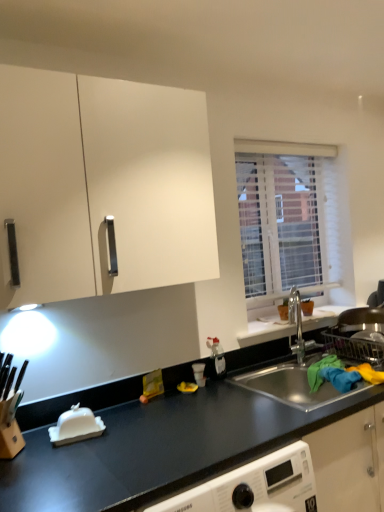
Question: From the image's perspective, is white matte cabinet at upper left located above or below stainless steel sink at lower right?

Choices:
 (A) below
 (B) above

Answer: (B)

Question: Considering their positions, is white matte cabinet at upper left located in front of or behind stainless steel sink at lower right?

Choices:
 (A) behind
 (B) front

Answer: (B)

Question: Which object is the farthest from the black matte countertop at center?

Choices:
 (A) stainless steel sink at lower right
 (B) white matte cabinet at upper left
 (C) white textured blinds at upper right

Answer: (C)

Question: Which object is positioned farthest from the black matte countertop at center?

Choices:
 (A) white matte cabinet at upper left
 (B) stainless steel sink at lower right
 (C) white textured blinds at upper right

Answer: (C)